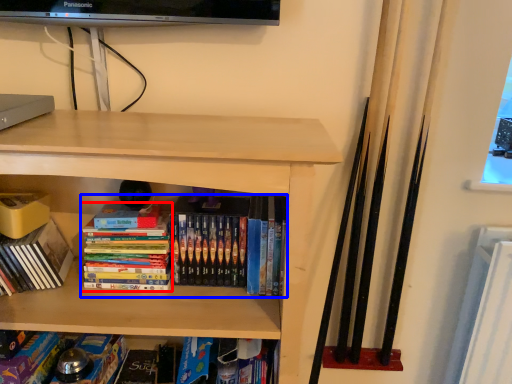
Question: Which point is further to the camera, book (highlighted by a red box) or book (highlighted by a blue box)?

Choices:
 (A) book
 (B) book

Answer: (A)